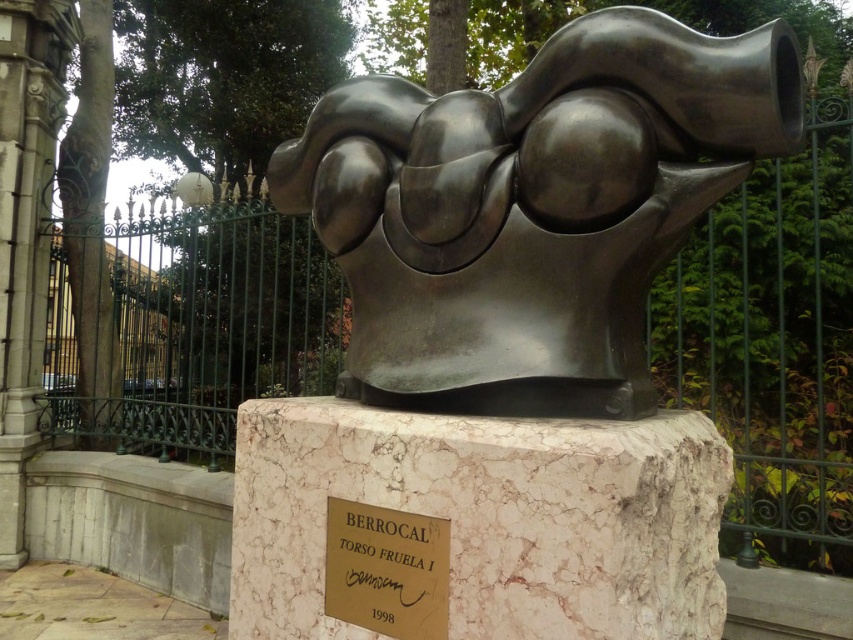
Between shiny bronze torso at center and gold metallic plaque at center, which one has less height?

With less height is gold metallic plaque at center.

Between point (410, 406) and point (405, 531), which one is positioned behind?

Point (410, 406)

This screenshot has width=853, height=640. Find the location of `shiny bronze torso at center`. shiny bronze torso at center is located at coordinates (532, 209).

Where is `shiny bronze torso at center`? shiny bronze torso at center is located at coordinates (532, 209).

How distant is shiny bronze torso at center from white marble plaque at center?

The distance of shiny bronze torso at center from white marble plaque at center is 14.88 inches.

Is shiny bronze torso at center wider than white marble plaque at center?

Yes, shiny bronze torso at center is wider than white marble plaque at center.

Locate an element on the screen. The height and width of the screenshot is (640, 853). shiny bronze torso at center is located at coordinates (532, 209).

Does gold metallic plaque at center appear under white marble plaque at center?

Yes.

Where is `gold metallic plaque at center`? gold metallic plaque at center is located at coordinates (386, 570).

Describe the element at coordinates (386, 570) in the screenshot. The width and height of the screenshot is (853, 640). I see `gold metallic plaque at center` at that location.

This screenshot has height=640, width=853. Identify the location of gold metallic plaque at center. (386, 570).